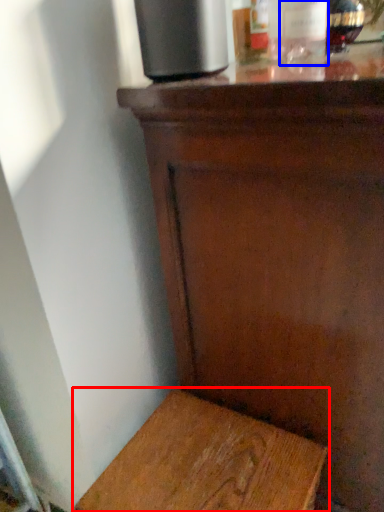
Question: Which object appears closest to the camera in this image, furniture (highlighted by a red box) or bottle (highlighted by a blue box)?

Choices:
 (A) furniture
 (B) bottle

Answer: (A)